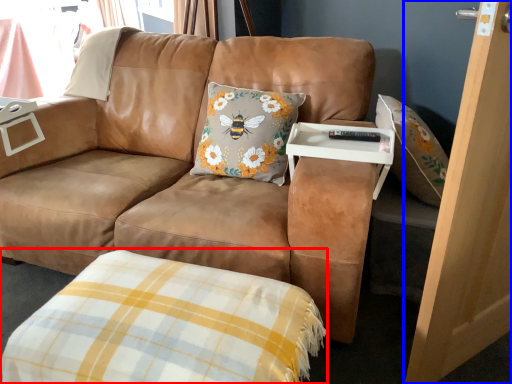
Question: Which object appears farthest to the camera in this image, plaid (highlighted by a red box) or screen door (highlighted by a blue box)?

Choices:
 (A) plaid
 (B) screen door

Answer: (A)